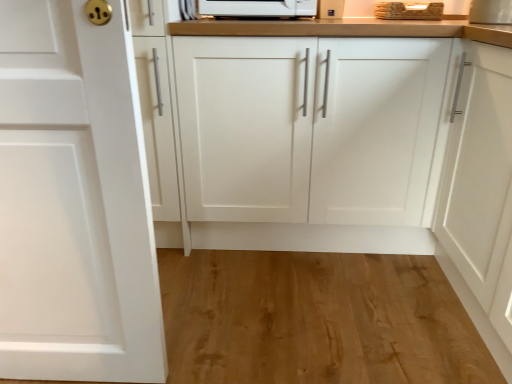
Question: Can you confirm if white matte cabinet door at left, placed as the second cabinetry when sorted from right to left, is thinner than natural wood flooring at lower center?

Choices:
 (A) no
 (B) yes

Answer: (B)

Question: From the image's perspective, would you say white matte cabinet door at left, placed as the first cabinetry when sorted from left to right, is shown under natural wood flooring at lower center?

Choices:
 (A) yes
 (B) no

Answer: (B)

Question: Is white matte cabinet door at left, placed as the second cabinetry when sorted from right to left, oriented towards natural wood flooring at lower center?

Choices:
 (A) no
 (B) yes

Answer: (A)

Question: Does white matte cabinet door at left, placed as the second cabinetry when sorted from right to left, lie behind natural wood flooring at lower center?

Choices:
 (A) yes
 (B) no

Answer: (B)

Question: Considering the relative positions of white matte cabinet door at left, placed as the second cabinetry when sorted from right to left, and natural wood flooring at lower center in the image provided, is white matte cabinet door at left, placed as the second cabinetry when sorted from right to left, to the left of natural wood flooring at lower center from the viewer's perspective?

Choices:
 (A) no
 (B) yes

Answer: (B)

Question: Is natural wood flooring at lower center wider or thinner than wooden at upper right?

Choices:
 (A) wide
 (B) thin

Answer: (A)

Question: From the image's perspective, is natural wood flooring at lower center positioned above or below wooden at upper right?

Choices:
 (A) below
 (B) above

Answer: (A)

Question: Considering the positions of point 329,324 and point 393,1, is point 329,324 closer or farther from the camera than point 393,1?

Choices:
 (A) closer
 (B) farther

Answer: (A)

Question: Visually, is natural wood flooring at lower center positioned to the left or to the right of wooden at upper right?

Choices:
 (A) right
 (B) left

Answer: (B)

Question: Do you think white matte cabinet at center, which appears as the second cabinetry when viewed from the left, is within natural wood flooring at lower center, or outside of it?

Choices:
 (A) outside
 (B) inside

Answer: (A)

Question: From a real-world perspective, is white matte cabinet at center, acting as the 2th cabinetry starting from the front, above or below natural wood flooring at lower center?

Choices:
 (A) above
 (B) below

Answer: (A)

Question: Is white matte cabinet at center, the first cabinetry in the right-to-left sequence, to the left or to the right of natural wood flooring at lower center in the image?

Choices:
 (A) right
 (B) left

Answer: (A)

Question: In the image, is white matte cabinet at center, which appears as the second cabinetry when viewed from the left, positioned in front of or behind natural wood flooring at lower center?

Choices:
 (A) front
 (B) behind

Answer: (B)

Question: From their relative heights in the image, would you say white matte cabinet door at left, placed as the second cabinetry when sorted from right to left, is taller or shorter than natural wood flooring at lower center?

Choices:
 (A) tall
 (B) short

Answer: (A)

Question: From the image's perspective, is white matte cabinet door at left, placed as the first cabinetry when sorted from left to right, located above or below natural wood flooring at lower center?

Choices:
 (A) below
 (B) above

Answer: (B)